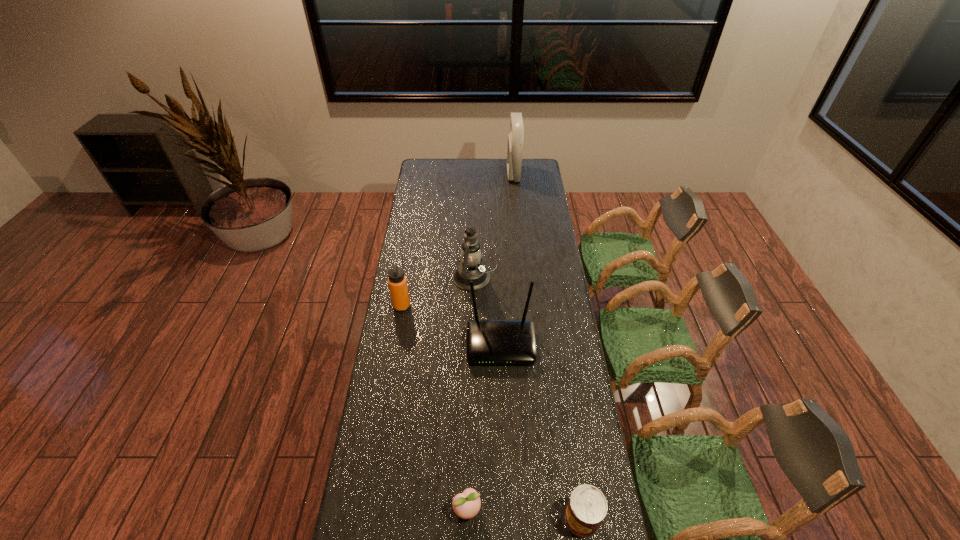
At what (x,y) coordinates should I click in order to perform the action: click on vacant area that lies between the first-aid kit and the fifth nearest object. Please return your answer as a coordinate pair (x, y). Image resolution: width=960 pixels, height=540 pixels. Looking at the image, I should click on (493, 226).

At what (x,y) coordinates should I click in order to perform the action: click on free spot between the second shortest object and the router. Please return your answer as a coordinate pair (x, y). The image size is (960, 540). Looking at the image, I should click on (541, 431).

At what (x,y) coordinates should I click in order to perform the action: click on empty space that is in between the farthest object and the thermos bottle. Please return your answer as a coordinate pair (x, y). Looking at the image, I should click on (458, 240).

Identify the location of the second closest object to the farthest object. (397, 282).

Locate which object is the fifth closest to the fifth nearest object. Please provide its 2D coordinates. Your answer should be formatted as a tuple, i.e. [(x, y)], where the tuple contains the x and y coordinates of a point satisfying the conditions above.

[(587, 507)]

The height and width of the screenshot is (540, 960). What are the coordinates of `free space that satisfies the following two spatial constraints: 1. on the front-facing side of the first-aid kit; 2. on the front-facing side of the fourth farthest object` in the screenshot? It's located at (530, 345).

What are the coordinates of `vacant region that satisfies the following two spatial constraints: 1. on the front-facing side of the third nearest object; 2. on the left side of the can` in the screenshot? It's located at (508, 518).

The image size is (960, 540). Find the location of `free location that satisfies the following two spatial constraints: 1. on the front-facing side of the first-aid kit; 2. on the left side of the can`. free location that satisfies the following two spatial constraints: 1. on the front-facing side of the first-aid kit; 2. on the left side of the can is located at coordinates (547, 518).